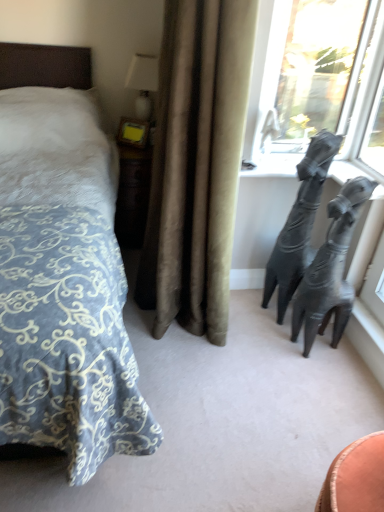
Question: Are shiny metallic sculpture at right and transparent glass window at upper right located far from each other?

Choices:
 (A) no
 (B) yes

Answer: (A)

Question: Is shiny metallic sculpture at right smaller than transparent glass window at upper right?

Choices:
 (A) no
 (B) yes

Answer: (A)

Question: From the image's perspective, would you say shiny metallic sculpture at right is shown under transparent glass window at upper right?

Choices:
 (A) no
 (B) yes

Answer: (B)

Question: Could you tell me if shiny metallic sculpture at right is turned towards transparent glass window at upper right?

Choices:
 (A) yes
 (B) no

Answer: (B)

Question: Is shiny metallic sculpture at right touching transparent glass window at upper right?

Choices:
 (A) yes
 (B) no

Answer: (B)

Question: Would you say velvet beige curtain at center is inside or outside transparent glass window at upper right?

Choices:
 (A) outside
 (B) inside

Answer: (A)

Question: From the image's perspective, is velvet beige curtain at center positioned above or below transparent glass window at upper right?

Choices:
 (A) above
 (B) below

Answer: (B)

Question: In terms of width, does velvet beige curtain at center look wider or thinner when compared to transparent glass window at upper right?

Choices:
 (A) thin
 (B) wide

Answer: (B)

Question: In the image, is velvet beige curtain at center positioned in front of or behind transparent glass window at upper right?

Choices:
 (A) behind
 (B) front

Answer: (B)

Question: In the image, is white glossy table lamp at upper center on the left side or the right side of velvet beige curtain at center?

Choices:
 (A) left
 (B) right

Answer: (A)

Question: Considering the positions of point (135, 74) and point (218, 153), is point (135, 74) closer or farther from the camera than point (218, 153)?

Choices:
 (A) farther
 (B) closer

Answer: (A)

Question: Looking at their shapes, would you say white glossy table lamp at upper center is wider or thinner than velvet beige curtain at center?

Choices:
 (A) thin
 (B) wide

Answer: (A)

Question: From the image's perspective, relative to velvet beige curtain at center, is white glossy table lamp at upper center above or below?

Choices:
 (A) below
 (B) above

Answer: (B)

Question: From a real-world perspective, is shiny metallic sculpture at right physically located above or below blue patterned fabric bed at left?

Choices:
 (A) above
 (B) below

Answer: (B)

Question: Considering their positions, is shiny metallic sculpture at right located in front of or behind blue patterned fabric bed at left?

Choices:
 (A) behind
 (B) front

Answer: (A)